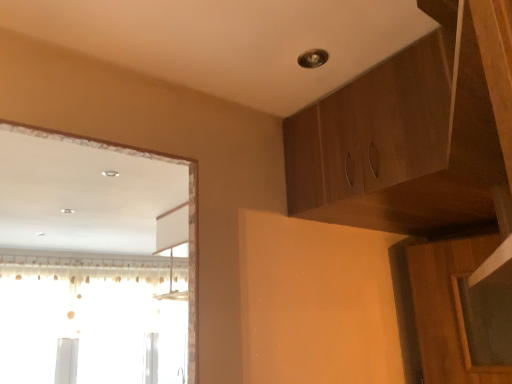
Question: From a real-world perspective, is wooden cabinet at upper right located beneath translucent fabric curtain at left?

Choices:
 (A) no
 (B) yes

Answer: (A)

Question: Is there a large distance between wooden cabinet at upper right and translucent fabric curtain at left?

Choices:
 (A) no
 (B) yes

Answer: (B)

Question: Is wooden cabinet at upper right not inside translucent fabric curtain at left?

Choices:
 (A) yes
 (B) no

Answer: (A)

Question: Does wooden cabinet at upper right have a lesser height compared to translucent fabric curtain at left?

Choices:
 (A) yes
 (B) no

Answer: (A)

Question: From a real-world perspective, is wooden cabinet at upper right located higher than translucent fabric curtain at left?

Choices:
 (A) yes
 (B) no

Answer: (A)

Question: Considering the relative positions of wooden cabinet at upper right and translucent fabric curtain at left in the image provided, is wooden cabinet at upper right to the left of translucent fabric curtain at left from the viewer's perspective?

Choices:
 (A) yes
 (B) no

Answer: (B)

Question: Does translucent fabric curtain at left have a greater height compared to wooden cabinet at upper right?

Choices:
 (A) no
 (B) yes

Answer: (B)

Question: Is translucent fabric curtain at left further to the viewer compared to wooden cabinet at upper right?

Choices:
 (A) yes
 (B) no

Answer: (A)

Question: From the image's perspective, would you say translucent fabric curtain at left is shown under wooden cabinet at upper right?

Choices:
 (A) yes
 (B) no

Answer: (A)

Question: Can you confirm if translucent fabric curtain at left is shorter than wooden cabinet at upper right?

Choices:
 (A) yes
 (B) no

Answer: (B)

Question: Does translucent fabric curtain at left lie in front of wooden cabinet at upper right?

Choices:
 (A) no
 (B) yes

Answer: (A)

Question: Is wooden cabinet at upper right located within translucent fabric curtain at left?

Choices:
 (A) yes
 (B) no

Answer: (B)

Question: From a real-world perspective, is wooden cabinet at upper right positioned above or below translucent fabric curtain at left?

Choices:
 (A) above
 (B) below

Answer: (A)